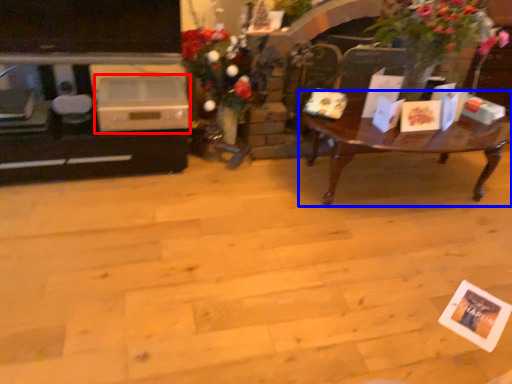
Question: Which of the following is the closest to the observer, appliance (highlighted by a red box) or coffee table (highlighted by a blue box)?

Choices:
 (A) appliance
 (B) coffee table

Answer: (B)